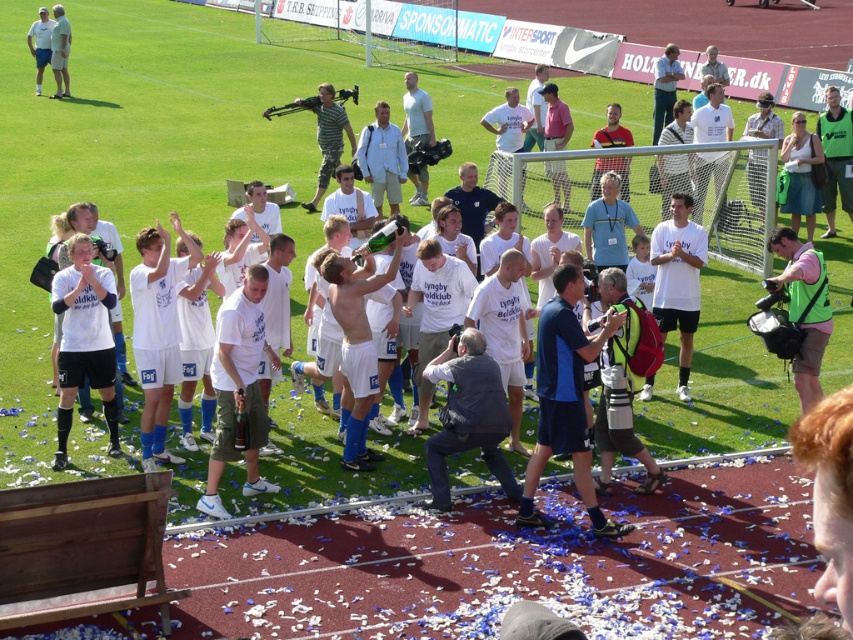
You are a photographer at the event and need to capture both the blue fabric jacket at center and the light blue shirt at upper left in a single frame. Which object should you focus on to ensure both are visible without zooming in too much?

You should focus on the blue fabric jacket at center because it occupies less space than the light blue shirt at upper left, allowing both to fit within the frame without excessive zooming.

You are a photographer standing at the edge of the soccer field. You want to take a photo of both the blue fabric jacket at center and the light blue shirt at upper left. Given that your camera has a maximum focus range of 25 meters, will you be able to capture both subjects clearly in the same frame?

The blue fabric jacket at center is 28.09 meters away from the light blue shirt at upper left. Since the camera can only focus up to 25 meters, the distance between them exceeds the maximum focus range. Therefore, you cannot capture both subjects clearly in the same frame.

In the image of the soccer team celebration, where exactly is the blue fabric jacket at center located in terms of coordinates?

The blue fabric jacket at center is located at coordinates point (566, 397).